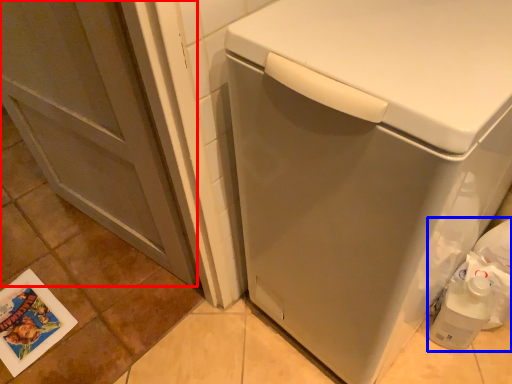
Question: Among these objects, which one is nearest to the camera, screen door (highlighted by a red box) or garbage (highlighted by a blue box)?

Choices:
 (A) screen door
 (B) garbage

Answer: (A)